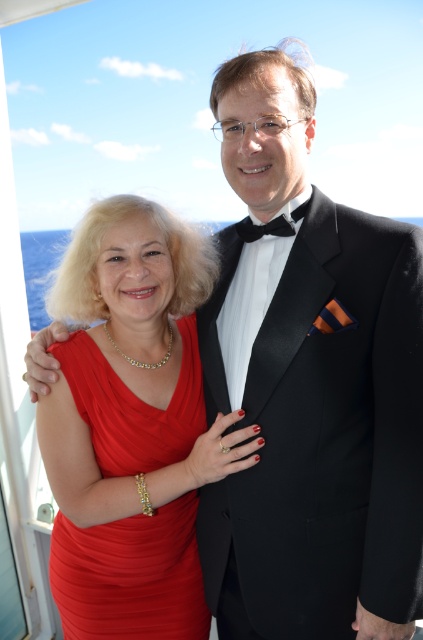
Measure the distance between shiny red dress at center and camera.

shiny red dress at center and camera are 1.26 meters apart from each other.

Is shiny red dress at center to the right of black satin bow tie at center from the viewer's perspective?

In fact, shiny red dress at center is to the left of black satin bow tie at center.

Between point (134, 529) and point (280, 236), which one is positioned behind?

The point (134, 529) is behind.

Find the location of a particular element. shiny red dress at center is located at coordinates (131, 577).

Does shiny red dress at center have a larger size compared to black satin bow tie at upper center?

Correct, shiny red dress at center is larger in size than black satin bow tie at upper center.

Is point (120, 637) in front of point (283, 228)?

No, it is behind (283, 228).

Does point (181, 576) come in front of point (244, 236)?

No, (181, 576) is behind (244, 236).

I want to click on shiny red dress at center, so click(131, 577).

Does point (252, 237) come farther from viewer compared to point (285, 225)?

Yes, point (252, 237) is behind point (285, 225).

This screenshot has width=423, height=640. What do you see at coordinates (271, 225) in the screenshot? I see `black satin bow tie at center` at bounding box center [271, 225].

The height and width of the screenshot is (640, 423). What are the coordinates of `black satin bow tie at center` in the screenshot? It's located at (271, 225).